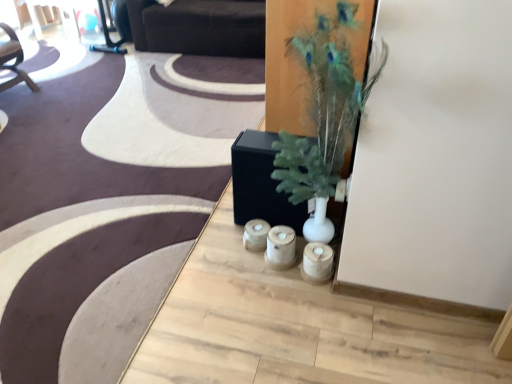
Question: Does dark brown leather couch at upper center have a lesser width compared to green feathered plant at center?

Choices:
 (A) no
 (B) yes

Answer: (A)

Question: Considering the relative sizes of dark brown leather couch at upper center and green feathered plant at center in the image provided, is dark brown leather couch at upper center taller than green feathered plant at center?

Choices:
 (A) yes
 (B) no

Answer: (B)

Question: From a real-world perspective, is dark brown leather couch at upper center over green feathered plant at center?

Choices:
 (A) yes
 (B) no

Answer: (B)

Question: From the image's perspective, would you say dark brown leather couch at upper center is positioned over green feathered plant at center?

Choices:
 (A) yes
 (B) no

Answer: (A)

Question: Considering the relative positions of dark brown leather couch at upper center and green feathered plant at center in the image provided, is dark brown leather couch at upper center behind green feathered plant at center?

Choices:
 (A) no
 (B) yes

Answer: (B)

Question: Is dark brown leather couch at upper center directly adjacent to green feathered plant at center?

Choices:
 (A) no
 (B) yes

Answer: (A)

Question: Is green feathered plant at center touching wooden candle holders at center?

Choices:
 (A) no
 (B) yes

Answer: (A)

Question: Is green feathered plant at center surrounding wooden candle holders at center?

Choices:
 (A) no
 (B) yes

Answer: (A)

Question: Is green feathered plant at center not near wooden candle holders at center?

Choices:
 (A) no
 (B) yes

Answer: (A)

Question: Is green feathered plant at center not within wooden candle holders at center?

Choices:
 (A) no
 (B) yes

Answer: (B)

Question: Can you confirm if green feathered plant at center is shorter than wooden candle holders at center?

Choices:
 (A) no
 (B) yes

Answer: (A)

Question: Is green feathered plant at center taller than wooden candle holders at center?

Choices:
 (A) no
 (B) yes

Answer: (B)

Question: From a real-world perspective, is wooden candle holders at center beneath dark brown leather couch at upper center?

Choices:
 (A) no
 (B) yes

Answer: (B)